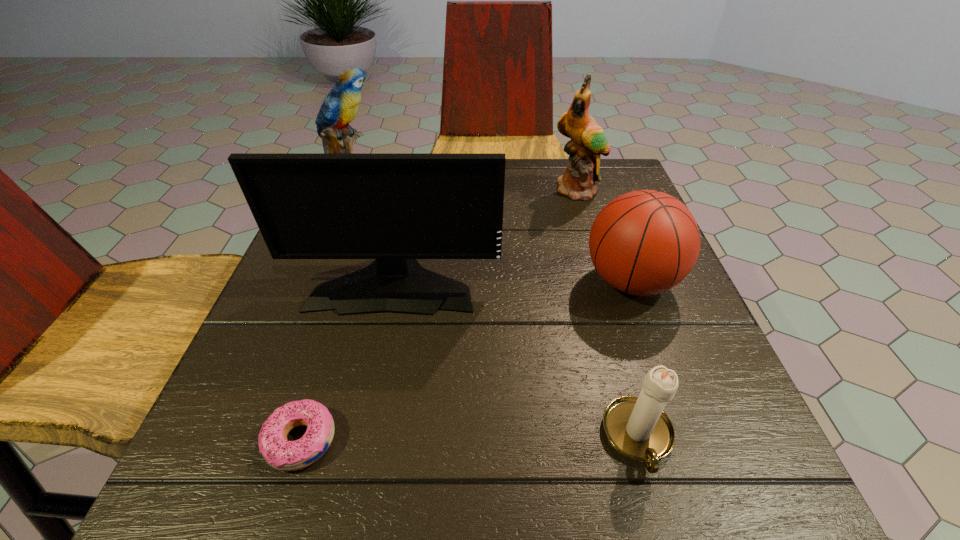
The width and height of the screenshot is (960, 540). Identify the location of object present at the near left corner. (281, 454).

Where is `object located in the far right corner section of the desktop`? Image resolution: width=960 pixels, height=540 pixels. object located in the far right corner section of the desktop is located at coordinates (588, 142).

Where is `object present at the near right corner`? Image resolution: width=960 pixels, height=540 pixels. object present at the near right corner is located at coordinates (637, 427).

Find the location of a particular element. The height and width of the screenshot is (540, 960). free location at the far edge of the desktop is located at coordinates (522, 179).

In order to click on free space at the near edge of the desktop in this screenshot , I will do `click(528, 496)`.

This screenshot has width=960, height=540. I want to click on vacant space at the left edge of the desktop, so click(270, 396).

Find the location of a particular element. vacant space at the right edge of the desktop is located at coordinates (661, 316).

Locate an element on the screen. The image size is (960, 540). vacant space at the near left corner is located at coordinates tap(260, 487).

Where is `vacant space at the far right corner`? This screenshot has width=960, height=540. vacant space at the far right corner is located at coordinates (612, 165).

Where is `free space at the near right corner of the desktop`? The width and height of the screenshot is (960, 540). free space at the near right corner of the desktop is located at coordinates point(758,489).